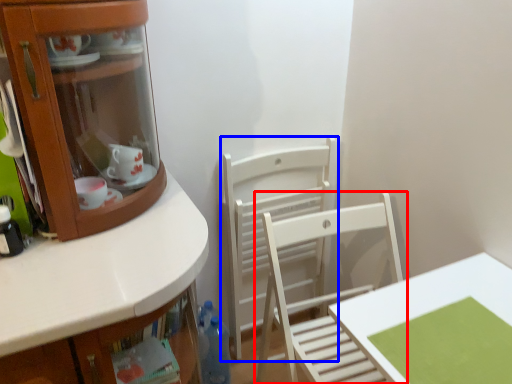
Question: Among these objects, which one is farthest to the camera, chair (highlighted by a red box) or chair (highlighted by a blue box)?

Choices:
 (A) chair
 (B) chair

Answer: (B)